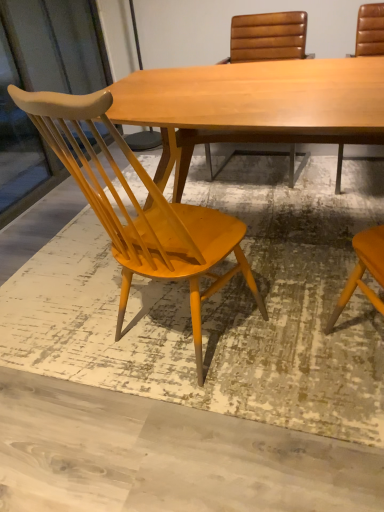
Question: Is matte yellow wood chair at left, marked as the 1th chair in a left-to-right arrangement, at the left side of leather at right, which is the 1th chair from right to left?

Choices:
 (A) no
 (B) yes

Answer: (B)

Question: Is matte yellow wood chair at left, marked as the 1th chair in a left-to-right arrangement, positioned far away from leather at right, the third chair when ordered from left to right?

Choices:
 (A) yes
 (B) no

Answer: (A)

Question: Would you say matte yellow wood chair at left, marked as the 1th chair in a left-to-right arrangement, is outside leather at right, which is the 1th chair from right to left?

Choices:
 (A) no
 (B) yes

Answer: (B)

Question: From the image's perspective, would you say matte yellow wood chair at left, marked as the 1th chair in a left-to-right arrangement, is shown under leather at right, which is the 1th chair from right to left?

Choices:
 (A) yes
 (B) no

Answer: (A)

Question: From the image's perspective, is matte yellow wood chair at left, marked as the 1th chair in a left-to-right arrangement, on top of leather at right, the third chair when ordered from left to right?

Choices:
 (A) no
 (B) yes

Answer: (A)

Question: From the image's perspective, is leather-like brown chair at upper center, which ranks as the second chair in left-to-right order, located above or below matte wood screen door at left?

Choices:
 (A) below
 (B) above

Answer: (A)

Question: Considering the relative positions of leather-like brown chair at upper center, which ranks as the second chair in left-to-right order, and matte wood screen door at left in the image provided, is leather-like brown chair at upper center, which ranks as the second chair in left-to-right order, to the left or to the right of matte wood screen door at left?

Choices:
 (A) right
 (B) left

Answer: (A)

Question: Is leather-like brown chair at upper center, placed as the second chair when sorted from right to left, spatially inside matte wood screen door at left, or outside of it?

Choices:
 (A) inside
 (B) outside

Answer: (B)

Question: Is leather-like brown chair at upper center, which ranks as the second chair in left-to-right order, bigger or smaller than matte wood screen door at left?

Choices:
 (A) small
 (B) big

Answer: (B)

Question: From a real-world perspective, is leather-like brown chair at upper center, which ranks as the second chair in left-to-right order, physically located above or below leather at right, the third chair when ordered from left to right?

Choices:
 (A) below
 (B) above

Answer: (A)

Question: Is leather-like brown chair at upper center, which ranks as the second chair in left-to-right order, inside the boundaries of leather at right, the third chair when ordered from left to right, or outside?

Choices:
 (A) inside
 (B) outside

Answer: (B)

Question: Considering their positions, is leather-like brown chair at upper center, which ranks as the second chair in left-to-right order, located in front of or behind leather at right, the third chair when ordered from left to right?

Choices:
 (A) behind
 (B) front

Answer: (A)

Question: In the image, is leather-like brown chair at upper center, which ranks as the second chair in left-to-right order, on the left side or the right side of leather at right, which is the 1th chair from right to left?

Choices:
 (A) left
 (B) right

Answer: (A)

Question: Considering the positions of point (382, 10) and point (24, 134), is point (382, 10) closer or farther from the camera than point (24, 134)?

Choices:
 (A) closer
 (B) farther

Answer: (A)

Question: From the image's perspective, is leather at right, the third chair when ordered from left to right, located above or below matte wood screen door at left?

Choices:
 (A) below
 (B) above

Answer: (A)